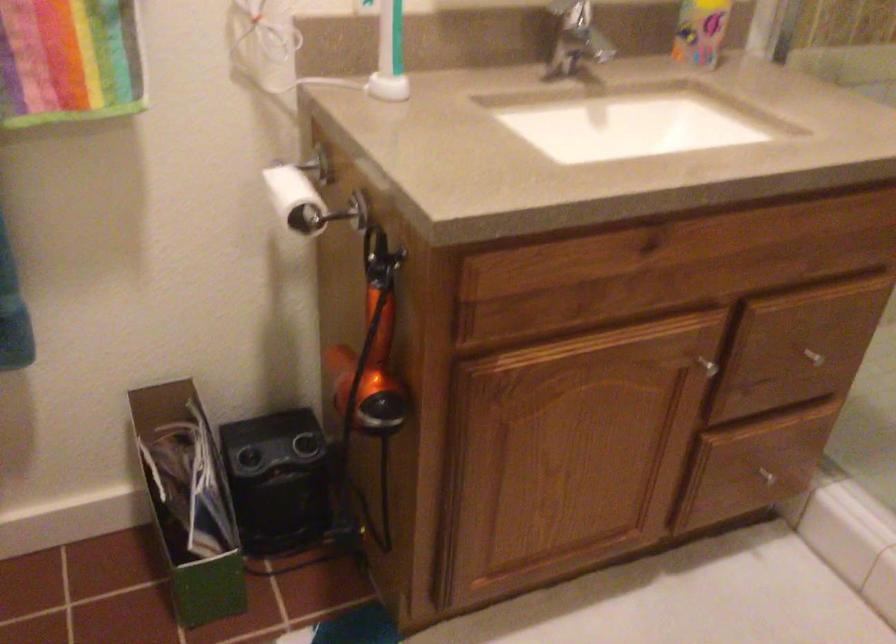
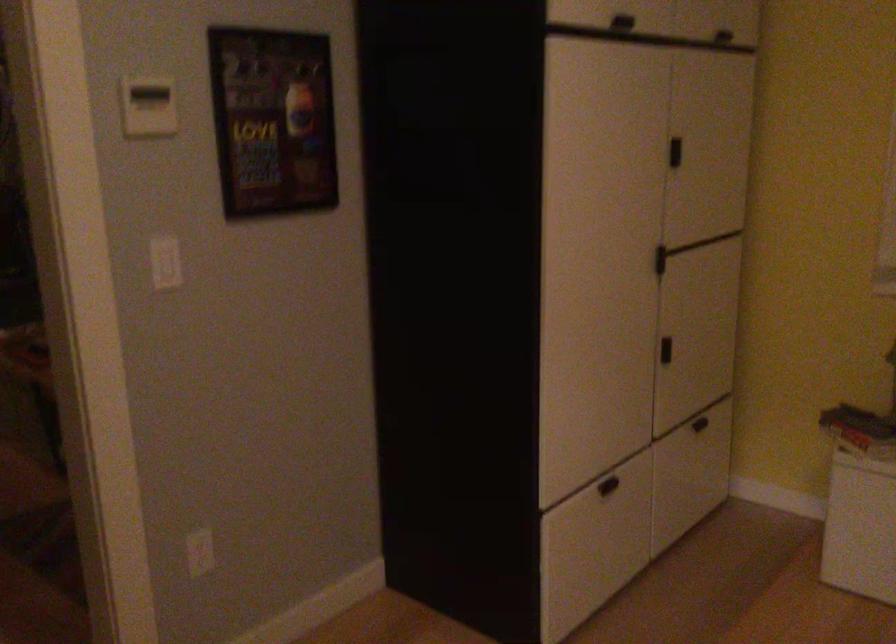
First-person continuous shooting, in which direction is the camera rotating?

The camera rotated toward right-down.